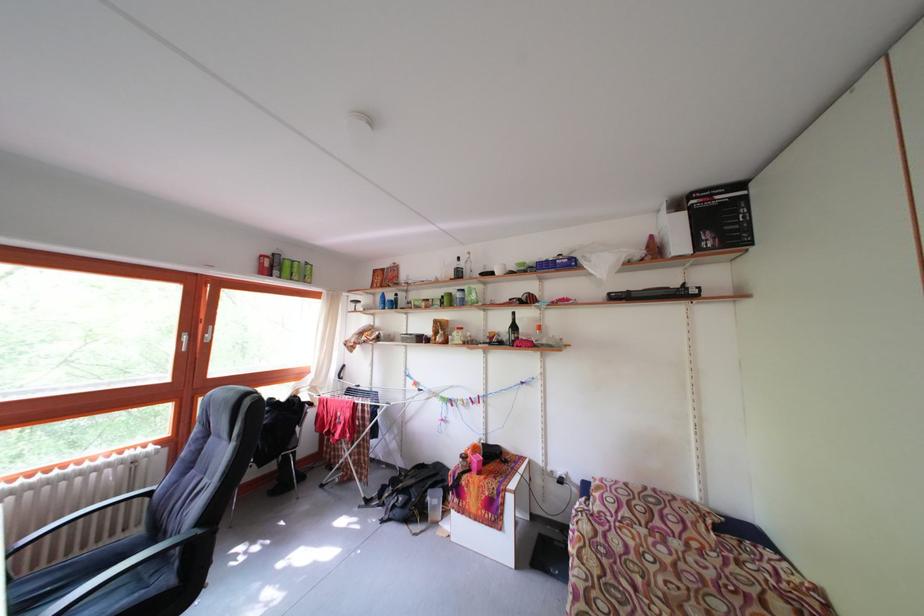
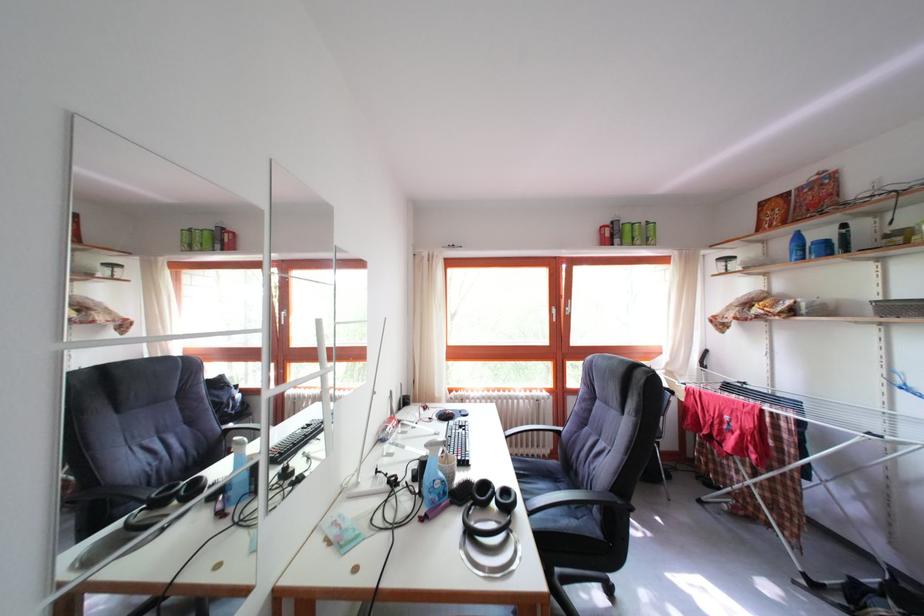
Question: How did the camera likely rotate?

Choices:
 (A) Left
 (B) Right
 (C) Up
 (D) Down

Answer: (A)